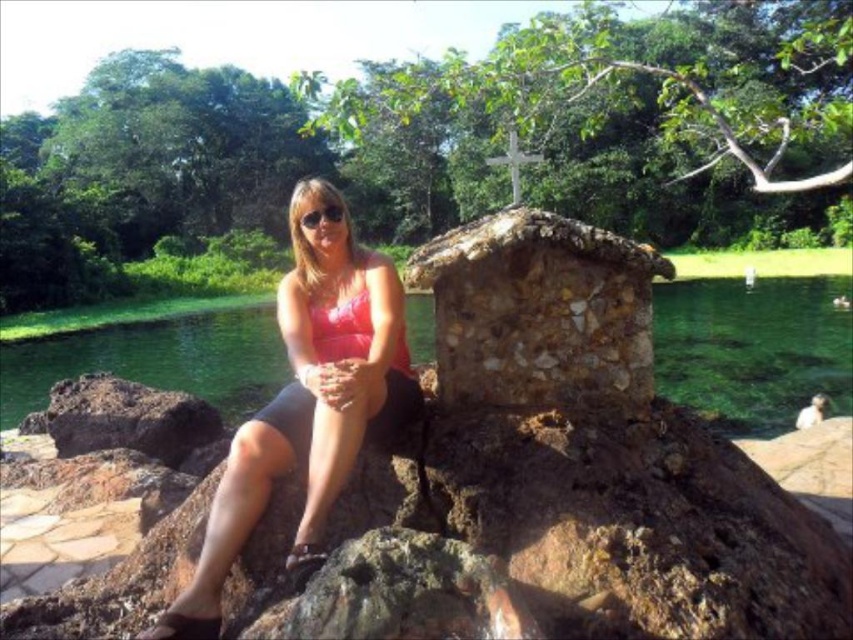
You are a swimmer who wants to put on your matte black goggles at center before entering the clear water at center. Based on the scene description, can you tell me which direction you should move your goggles to align them with the water?

The clear water at center is to the right of the matte black goggles at center, so you should move the matte black goggles at center to the right to align them with the clear water at center.

You are a photographer wanting to capture the pink matte bikini top at center and the dark brown rock at lower left in the same frame. Based on their positions, which object would you focus on first to ensure both are in the shot?

The dark brown rock at lower left is located below the pink matte bikini top at center, so you should focus on the pink matte bikini top at center first to ensure both are in the frame.